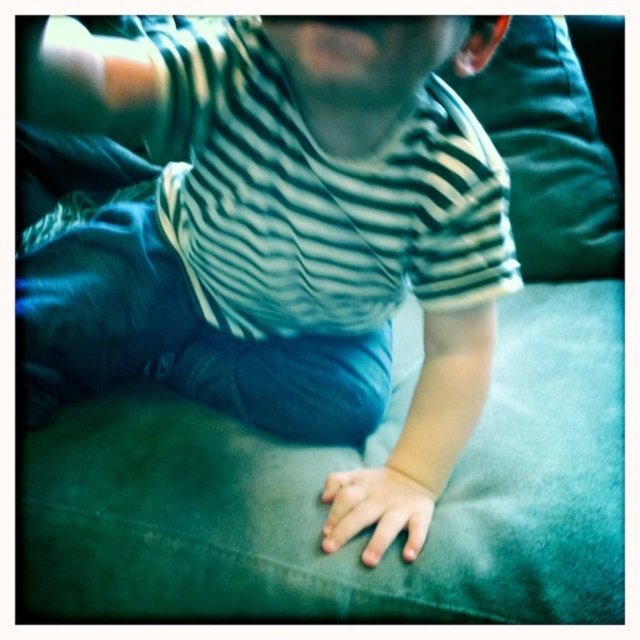
You are a photographer adjusting the focus of your camera. You want to ensure that both the striped cotton shirt at center and the smooth skin hand at center are in focus. Given their positions, which object should you focus on first to achieve this?

You should focus on the striped cotton shirt at center first because it is closer to the viewer than the smooth skin hand at center. By focusing on the closer object, the depth of field may extend to include the farther object in acceptable focus.

Based on the photo, you are a photographer adjusting the lighting in this scene. You need to ensure that the smooth skin hand at center and the green fabric pillow at upper right are both clearly visible. Which object should you focus on first to ensure proper exposure, considering their positions?

The smooth skin hand at center is behind the green fabric pillow at upper right, so you should focus on the green fabric pillow at upper right first to ensure proper exposure since it is closer to the camera.

In the scene shown: You are a photographer adjusting the focus on your camera. You want to ensure the green fabric pillow at upper right is centered in the frame. What adjustment should you make to the camera to center the pillow?

The green fabric pillow at upper right is located at coordinates approximately 0.239 on the x axis and 0.859 on the y axis. To center it, move the camera to the left and down so the pillow moves to the center of the frame.